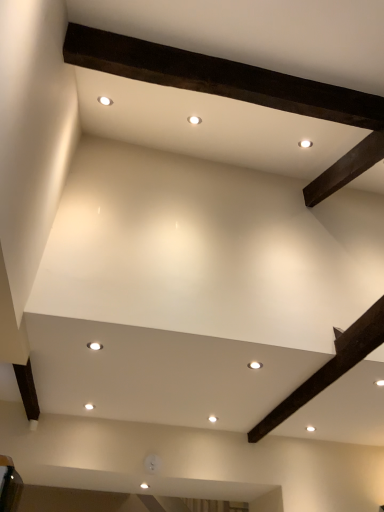
Question: Is white glossy light fixture at center, the second lighting viewed from the front, not near white glossy light fixture at center, acting as the 2th lighting starting from the back?

Choices:
 (A) no
 (B) yes

Answer: (A)

Question: Is white glossy light fixture at center, the second lighting from the left, further to the viewer compared to white glossy light fixture at center, placed as the first lighting when sorted from left to right?

Choices:
 (A) no
 (B) yes

Answer: (B)

Question: Is white glossy light fixture at center, the second lighting viewed from the front, smaller than white glossy light fixture at center, which appears as the first lighting when viewed from the top?

Choices:
 (A) yes
 (B) no

Answer: (A)

Question: Considering the relative sizes of white glossy light fixture at center, the second lighting from the left, and white glossy light fixture at center, acting as the 2th lighting starting from the back, in the image provided, is white glossy light fixture at center, the second lighting from the left, bigger than white glossy light fixture at center, acting as the 2th lighting starting from the back,?

Choices:
 (A) no
 (B) yes

Answer: (A)

Question: Considering the relative sizes of white glossy light fixture at center, which ranks as the second lighting in top-to-bottom order, and white glossy light fixture at center, which is counted as the second lighting, starting from the bottom, in the image provided, is white glossy light fixture at center, which ranks as the second lighting in top-to-bottom order, thinner than white glossy light fixture at center, which is counted as the second lighting, starting from the bottom,?

Choices:
 (A) no
 (B) yes

Answer: (A)

Question: From the image's perspective, does white glossy light fixture at center, which appears as the first lighting when ordered from the bottom, appear higher than white glossy light fixture at center, which appears as the first lighting when viewed from the top?

Choices:
 (A) no
 (B) yes

Answer: (A)

Question: Does white glossy light fixture at center, acting as the 2th lighting starting from the back, have a greater height compared to white glossy light fixture at center, the second lighting from the left?

Choices:
 (A) no
 (B) yes

Answer: (B)

Question: Is white glossy light fixture at center, the first lighting positioned from the front, shorter than white glossy light fixture at center, which ranks as the second lighting in top-to-bottom order?

Choices:
 (A) no
 (B) yes

Answer: (A)

Question: Is white glossy light fixture at center, which appears as the first lighting when viewed from the top, closer to the viewer compared to white glossy light fixture at center, the second lighting viewed from the front?

Choices:
 (A) yes
 (B) no

Answer: (A)

Question: Is white glossy light fixture at center, which is counted as the second lighting, starting from the bottom, outside white glossy light fixture at center, placed as the first lighting when sorted from back to front?

Choices:
 (A) yes
 (B) no

Answer: (A)

Question: From the image's perspective, is white glossy light fixture at center, the first lighting positioned from the front, beneath white glossy light fixture at center, acting as the first lighting starting from the right?

Choices:
 (A) no
 (B) yes

Answer: (A)

Question: Considering the relative sizes of white glossy light fixture at center, which is counted as the second lighting, starting from the bottom, and white glossy light fixture at center, placed as the first lighting when sorted from back to front, in the image provided, is white glossy light fixture at center, which is counted as the second lighting, starting from the bottom, wider than white glossy light fixture at center, placed as the first lighting when sorted from back to front,?

Choices:
 (A) yes
 (B) no

Answer: (B)

Question: From their relative heights in the image, would you say white glossy light fixture at center, acting as the first lighting starting from the right, is taller or shorter than white glossy light fixture at center, the first lighting positioned from the front?

Choices:
 (A) short
 (B) tall

Answer: (A)